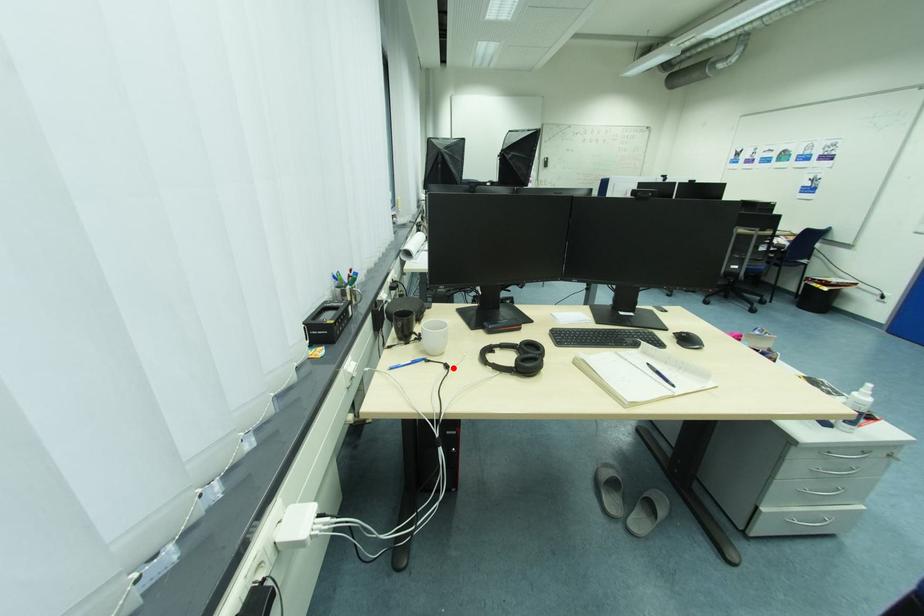
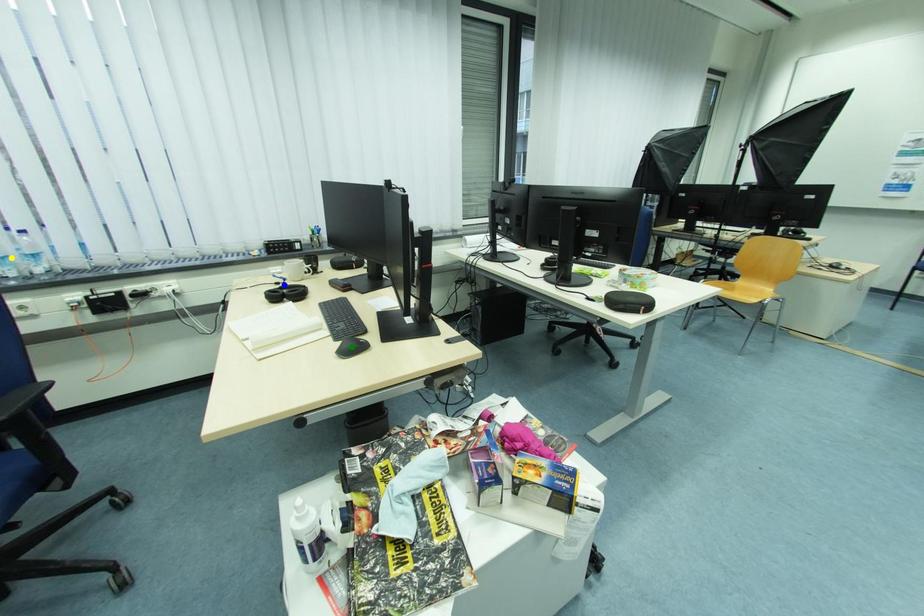
Question: I am providing you with two images of the same scene from different viewpoints. A red point is marked on the first image. You are given multiple points on the second image. Which point in image 2 represents the same 3d spot as the red point in image 1?

Choices:
 (A) green point
 (B) blue point
 (C) yellow point

Answer: (B)